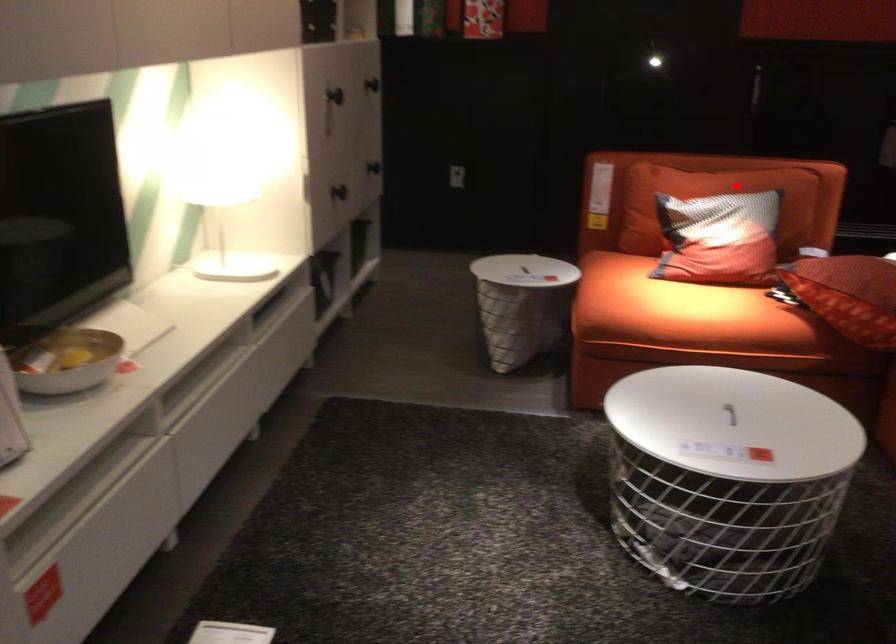
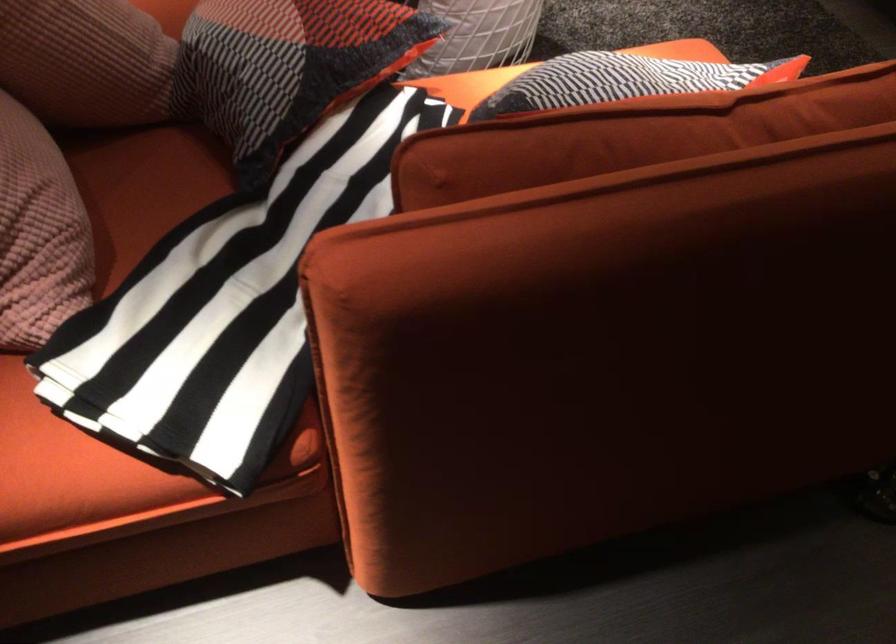
Question: I am providing you with two images of the same scene from different viewpoints. Given a red point in image1, look at the same physical point in image2. Is it:

Choices:
 (A) Closer to the viewpoint
 (B) Farther from the viewpoint

Answer: (A)